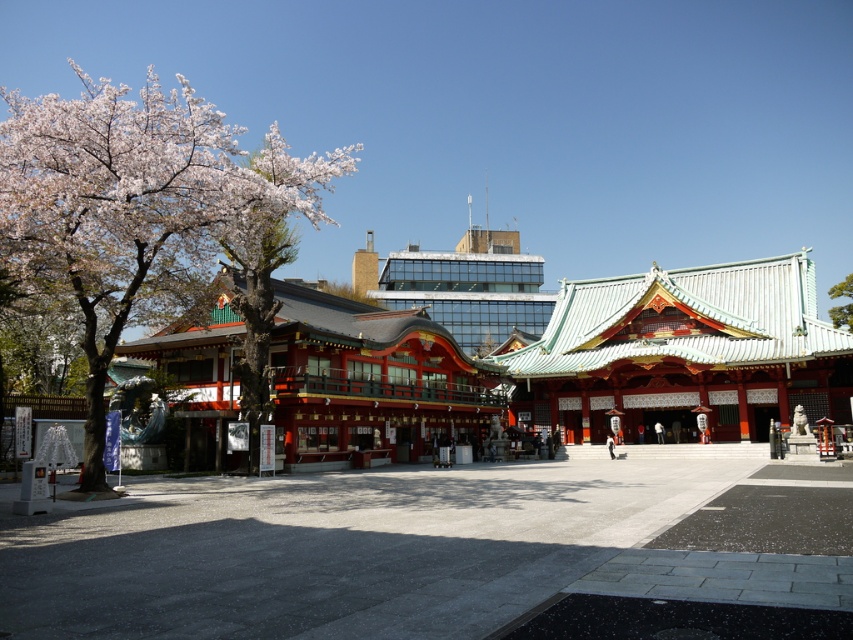
You are standing in front of the shrine and want to take a photo of the smooth bark tree at left. Where should you position yourself to capture it in the frame?

To capture the smooth bark tree at left in your photo, position yourself so that the tree is within the frame at its 2D location coordinates of approximately 0.317 on the x axis and 0.130 on the y axis.

You are a visitor at the shrine and want to take a photo of both the smooth bark tree at left and the green leafy tree at upper center. Which tree should you stand closer to in order to capture both in a single frame?

You should stand closer to the smooth bark tree at left since it is thinner than the green leafy tree at upper center, allowing both to fit within the camera frame more easily.